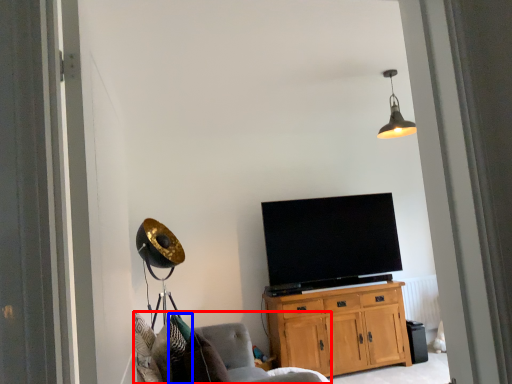
Question: Which object appears farthest to the camera in this image, chair (highlighted by a red box) or pillow (highlighted by a blue box)?

Choices:
 (A) chair
 (B) pillow

Answer: (B)